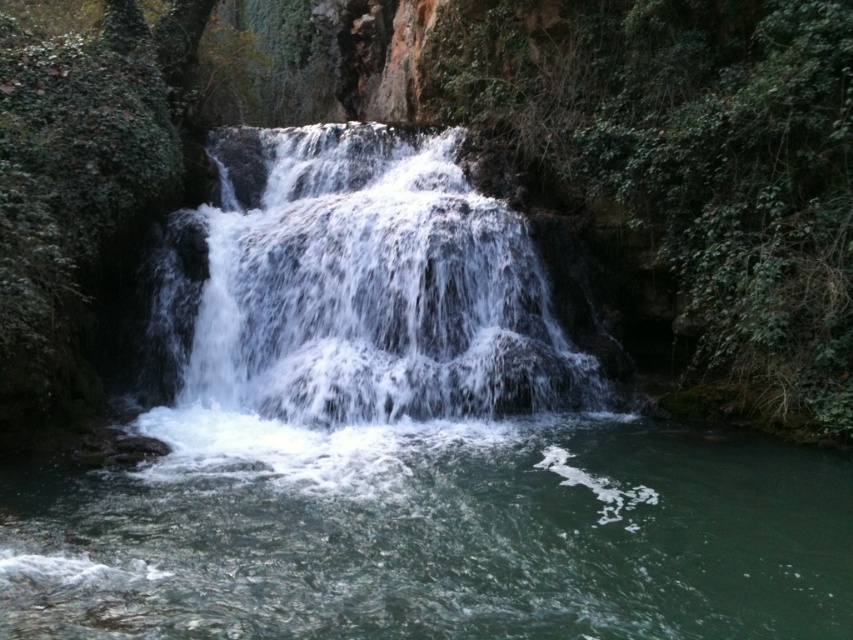
You are standing at the edge of the pool and see the clear water at center and the green leafy vegetation at center. Which one is closer to your right side?

The green leafy vegetation at center is closer to your right side because the clear water at center is to the left of it.

You are a hiker who wants to take a photo of the white frothy water at center and the green leafy vegetation at center. Which object should you focus on first if you want to capture both in one frame without moving your camera?

You should focus on the green leafy vegetation at center first because it is taller than the white frothy water at center, allowing you to frame both by adjusting the camera angle to include both the taller vegetation and the shorter frothy water.